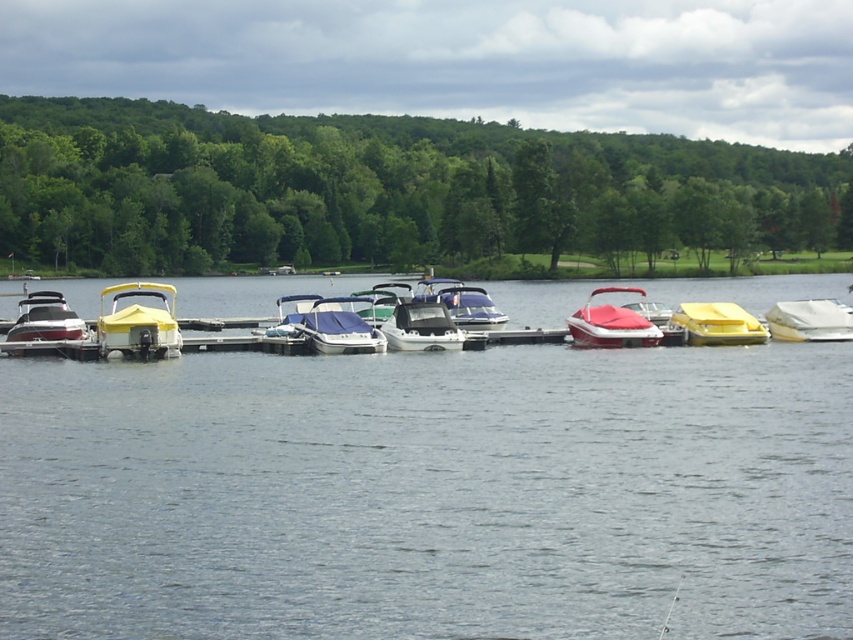
You are standing on the wooden pier and looking towards the blue vinyl boat at center. Which direction should you look to see the green leafy trees at upper left?

The green leafy trees at upper left are to the right of the blue vinyl boat at center, so you should look to your right to see them.

You are standing on the lakeside dock and want to board the white matte boat at right. Considering the dock is 40 meters long, can you reach the boat by walking along the dock?

The white matte boat at right is 46.27 meters from viewer, which is beyond the dock length of 40 meters. You cannot reach it by walking along the dock.